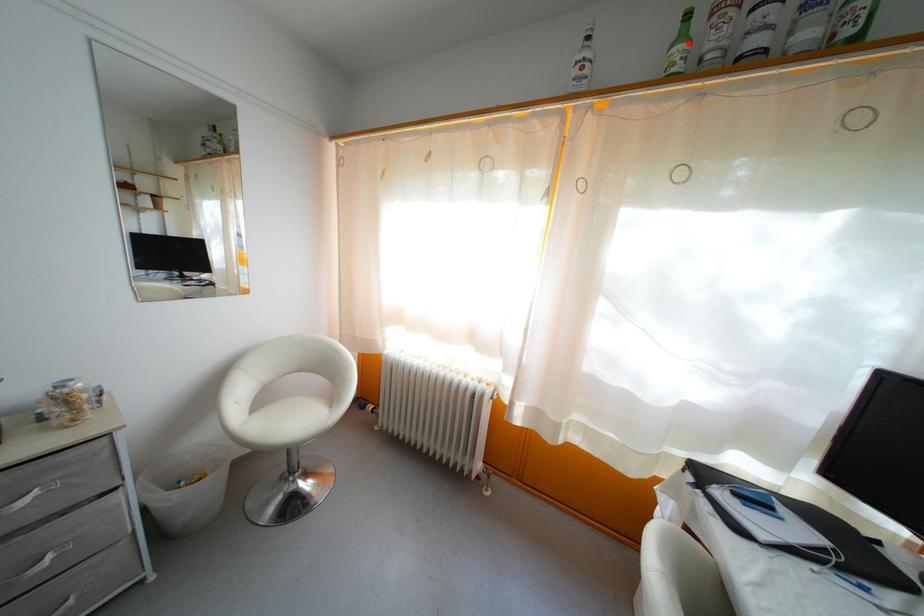
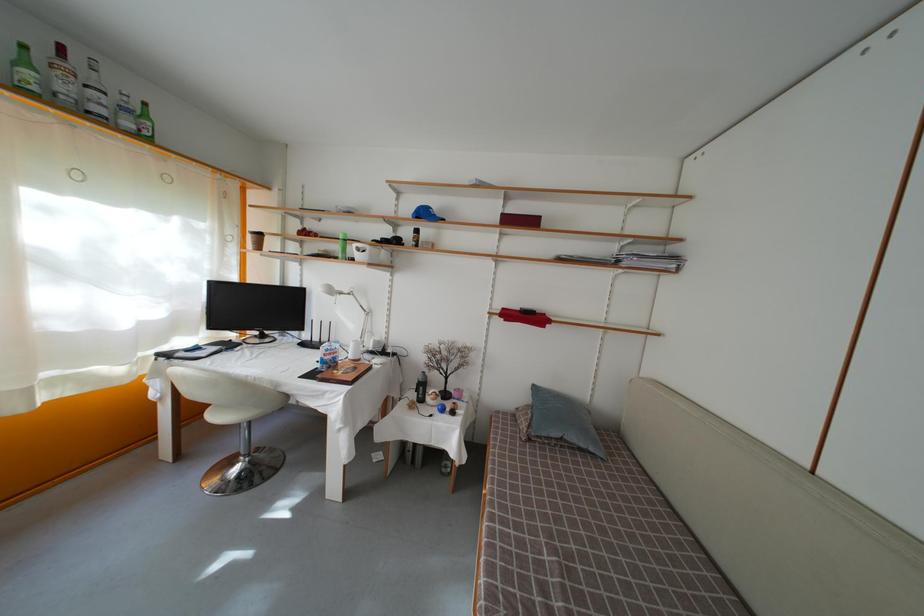
In the second image, find the point that corresponds to the highlighted location in the first image.

(31, 69)